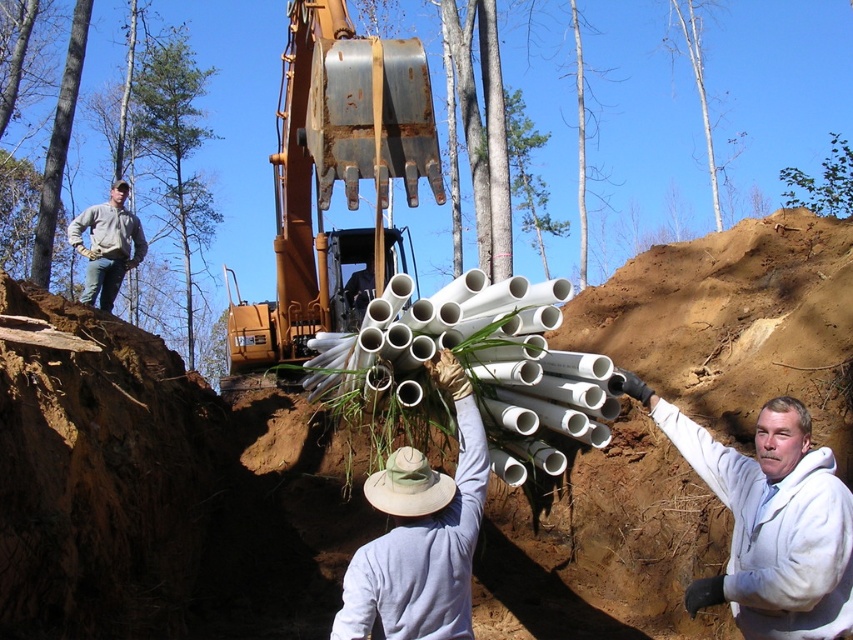
You are a construction worker standing at the edge of the trench and need to place a safety cone between the two points labeled point (805, 593) and point (115, 202). Which point should you place the cone closer to so that it is nearer to the viewer?

You should place the safety cone closer to point (805, 593) because it is closer to the viewer than point (115, 202).

You are a construction worker standing at the camera position. You need to pick up the white matte pipe at center. Can you reach it without moving your feet?

The white matte pipe at center is 3.60 meters away from the camera position. Since the average human arm length is about 0.7 meters, you cannot reach it without moving your feet.

You are a construction worker who needs to identify the items in the scene. Which object is bigger between the white fleece jacket at right and the white matte pipe at center?

The white fleece jacket at right is larger in size than the white matte pipe at center.